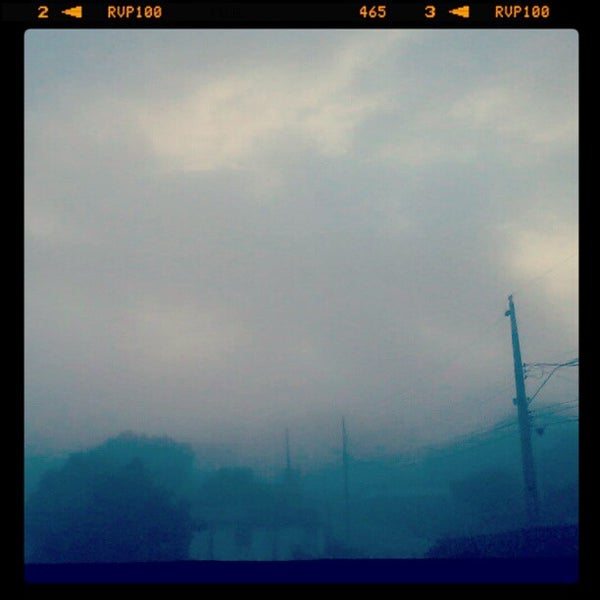
Locate an element on the screen. The image size is (600, 600). cable is located at coordinates (560, 411).